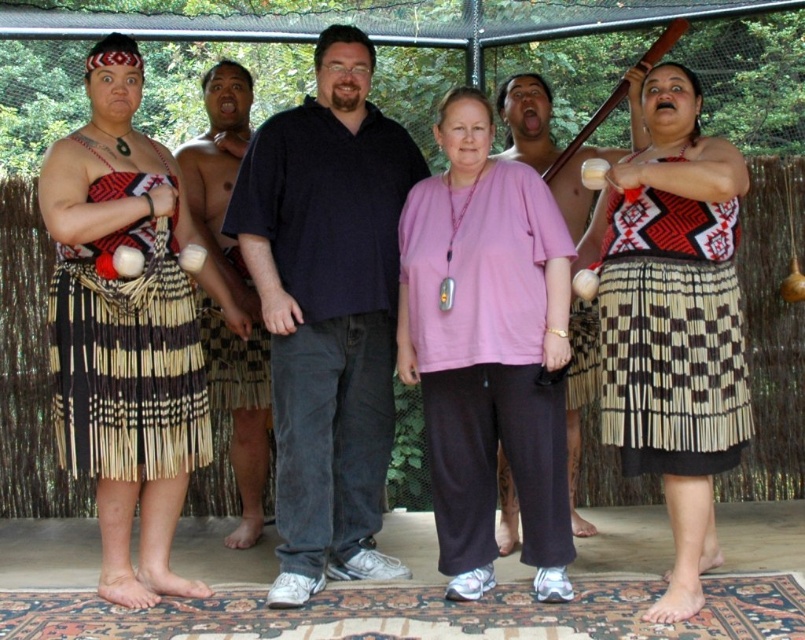
Based on the photo, between natural woven skirt at left and matte black skirt at center, which one is positioned higher?

natural woven skirt at left is above.

Looking at this image, is natural woven skirt at left positioned in front of matte black skirt at center?

No, natural woven skirt at left is further to the viewer.

Who is more distant from viewer, (182,212) or (679,202)?

Point (182,212)

Where is `natural woven skirt at left`? This screenshot has height=640, width=805. natural woven skirt at left is located at coordinates (126, 326).

Does matte black skirt at center lie in front of matte black shirt at center?

Yes, matte black skirt at center is in front of matte black shirt at center.

Can you confirm if matte black skirt at center is smaller than matte black shirt at center?

Actually, matte black skirt at center might be larger than matte black shirt at center.

What are the coordinates of `matte black skirt at center` in the screenshot? It's located at (673, 321).

Based on the photo, who is positioned more to the left, dark blue shirt at center or matte black skirt at center?

dark blue shirt at center is more to the left.

Is point (358, 248) positioned before point (646, 246)?

No, (358, 248) is behind (646, 246).

What do you see at coordinates (328, 310) in the screenshot? I see `dark blue shirt at center` at bounding box center [328, 310].

Where is `dark blue shirt at center`? This screenshot has height=640, width=805. dark blue shirt at center is located at coordinates (328, 310).